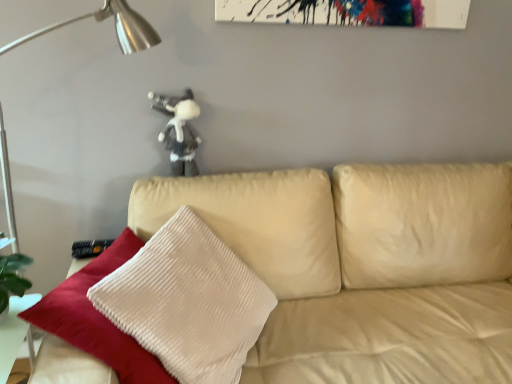
Locate an element on the screen. The height and width of the screenshot is (384, 512). free space in front of white plush toy at upper center is located at coordinates (170, 185).